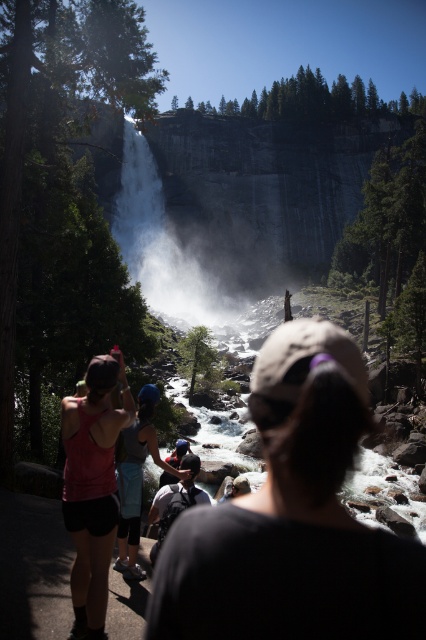
You are a photographer trying to capture the white textured waterfall at center. You notice a tourist wearing a pink fabric tank top at left in your shot. To avoid including the tourist in your photo, should you move to your left or right?

The pink fabric tank top at left is positioned on the right side of the white textured waterfall at center. To avoid including the tourist, you should move to your right side.

You are a hiker planning to cross the river below the waterfall. You see a matte blue helmet at center located at point [135,477]. Is the helmet in the river or on the rocky bank?

The matte blue helmet at center located at point [135,477] is on the rocky bank, not in the river.